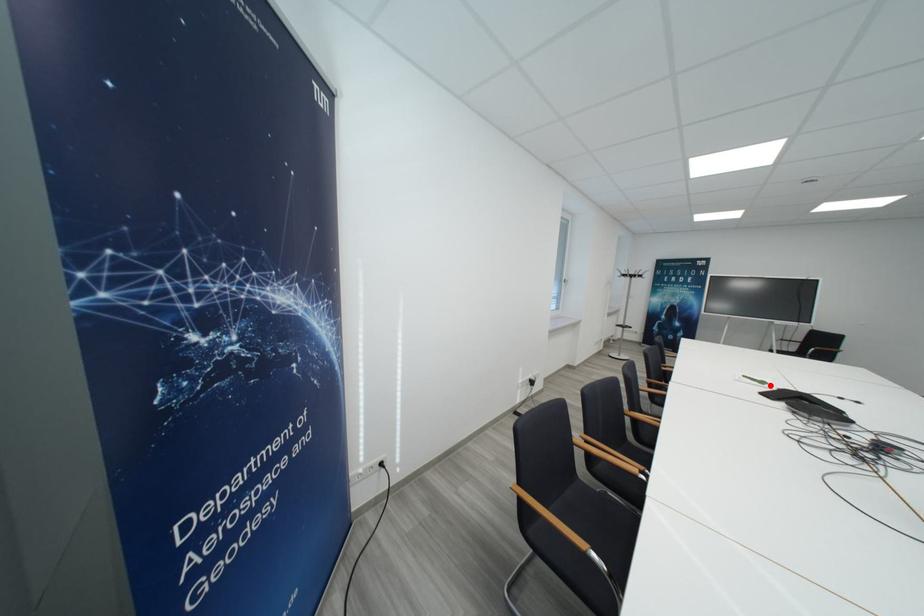
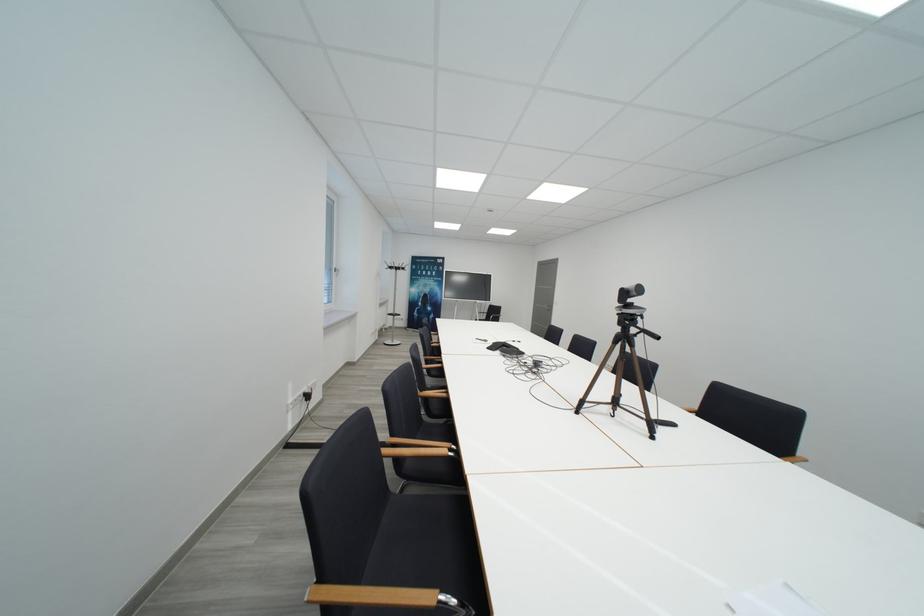
Locate, in the second image, the point that corresponds to the highlighted location in the first image.

(492, 344)